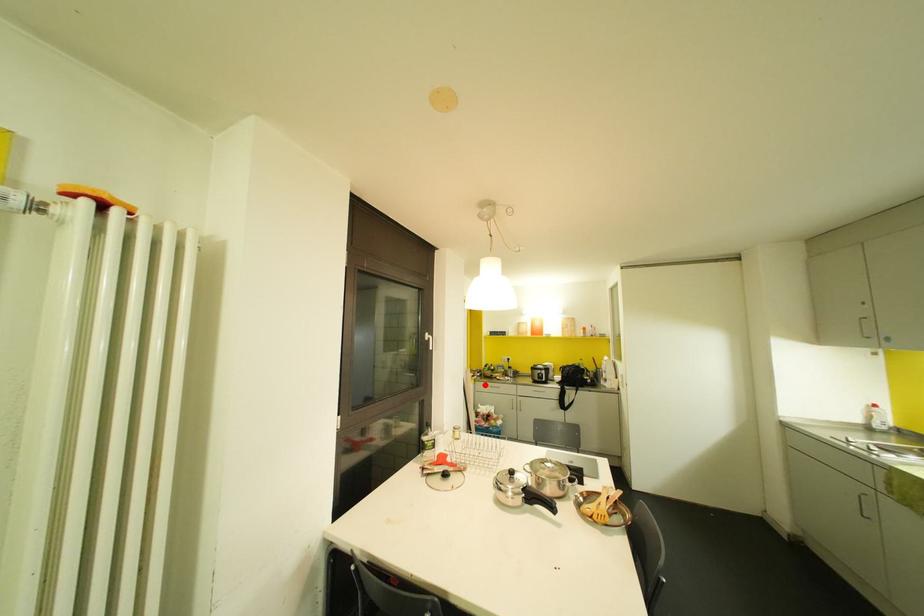
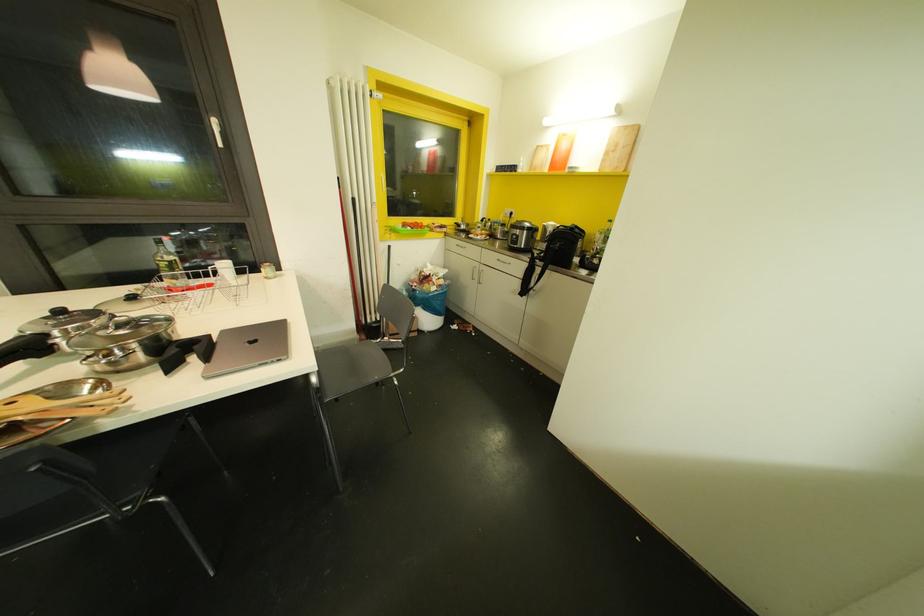
Question: I am providing you with two images of the same scene from different viewpoints. In image1, a red point is highlighted. Considering the same 3D point in image2, which of the following is correct?

Choices:
 (A) It is closer
 (B) It is farther

Answer: (A)